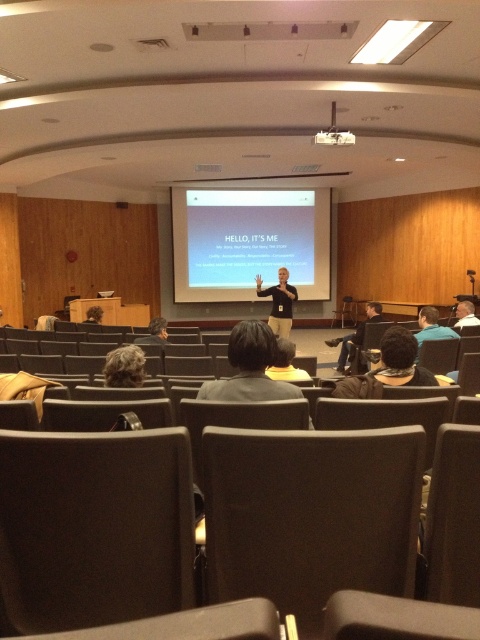
Between blonde hair at lower left and matte black projector at upper center, which one has more height?

With more height is matte black projector at upper center.

Who is shorter, blonde hair at lower left or matte black projector at upper center?

With less height is blonde hair at lower left.

Which is behind, point (140, 362) or point (340, 140)?

The point (340, 140) is more distant.

The height and width of the screenshot is (640, 480). I want to click on blonde hair at lower left, so click(124, 365).

Does dark brown fabric chair at center have a lesser width compared to dark brown leather chair at lower left?

In fact, dark brown fabric chair at center might be wider than dark brown leather chair at lower left.

In the scene shown: Who is more forward, [389,451] or [58,438]?

Point [58,438] is more forward.

Find the location of a particular element. dark brown fabric chair at center is located at coordinates (311, 515).

Who is more forward, (x=367, y=304) or (x=340, y=140)?

Positioned in front is point (x=340, y=140).

Based on the photo, is dark blue jeans at center in front of matte black projector at upper center?

No, dark blue jeans at center is further to the viewer.

Is point (376, 307) positioned after point (339, 141)?

Yes, point (376, 307) is behind point (339, 141).

Identify the location of dark blue jeans at center. (356, 336).